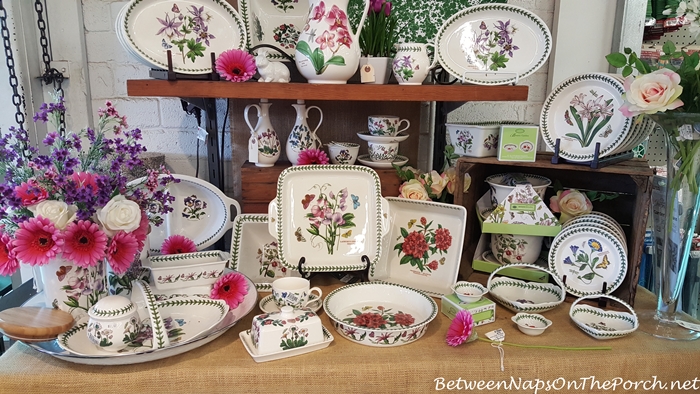
I want to click on wood shelf, so click(260, 94).